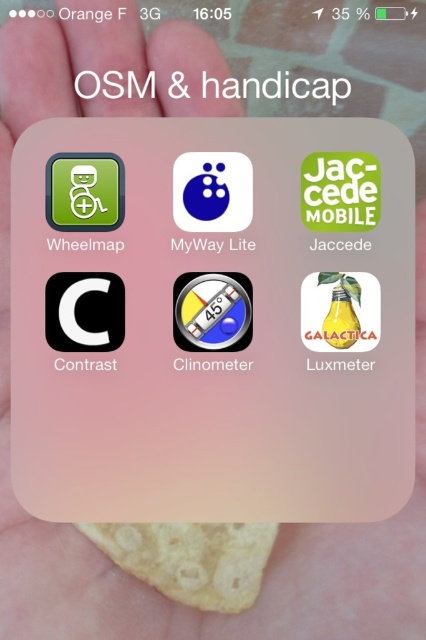
Question: Which object is positioned closest to the translucent glass clinometer at center?

Choices:
 (A) yellow crispy chip at center
 (B) green matte icon at upper left

Answer: (B)

Question: Which of the following is the farthest from the observer?

Choices:
 (A) green matte icon at upper left
 (B) translucent glass clinometer at center
 (C) blue glossy sphere at center

Answer: (B)

Question: Which of the following is the farthest from the observer?

Choices:
 (A) blue glossy sphere at center
 (B) green matte icon at upper left
 (C) translucent glass clinometer at center

Answer: (C)

Question: Can you confirm if translucent glass clinometer at center is positioned to the left of green matte icon at upper left?

Choices:
 (A) no
 (B) yes

Answer: (A)

Question: Is yellow crispy chip at center smaller than translucent glass clinometer at center?

Choices:
 (A) no
 (B) yes

Answer: (A)

Question: Can you confirm if yellow crispy chip at center is wider than translucent glass clinometer at center?

Choices:
 (A) yes
 (B) no

Answer: (A)